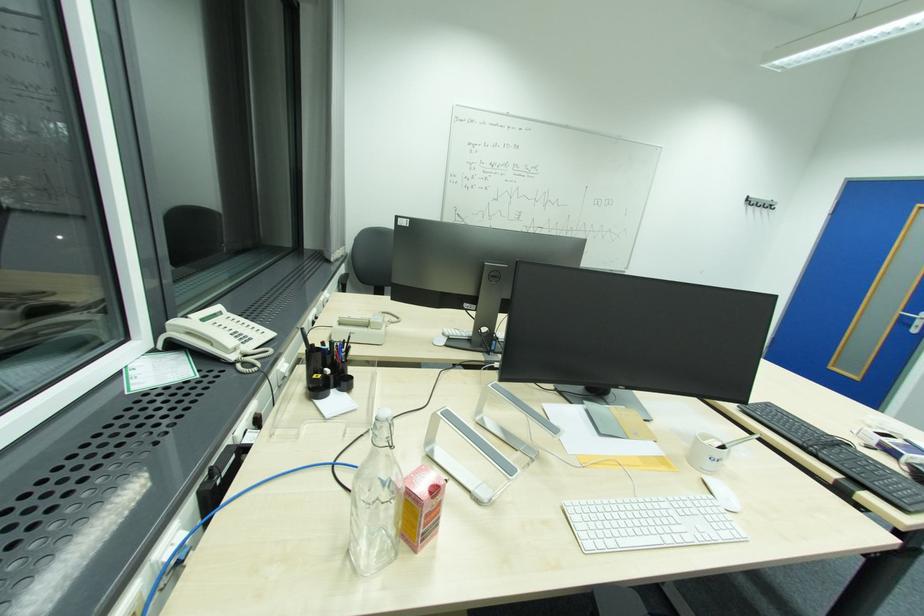
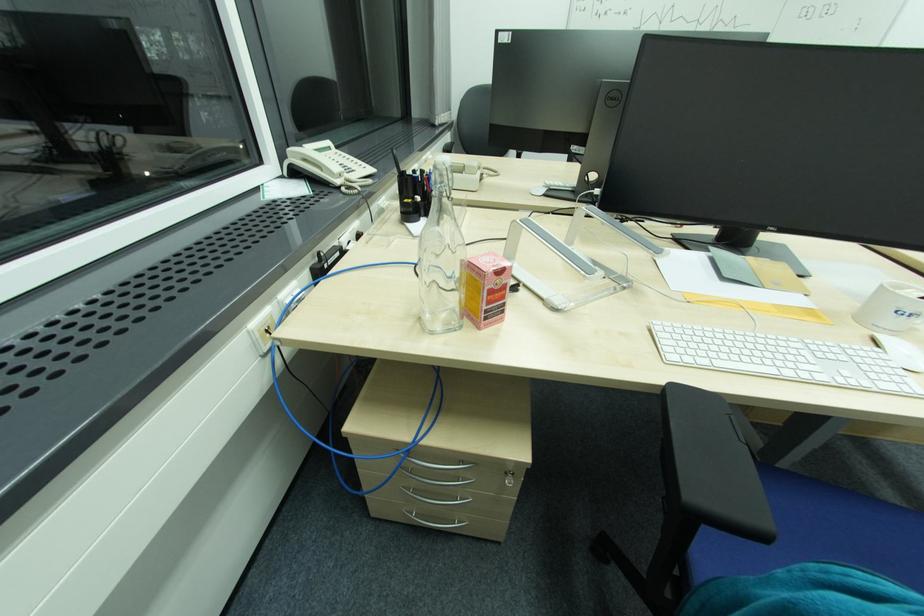
Which direction would the cameraman need to move to produce the second image?

The cameraman walked toward right, forward.